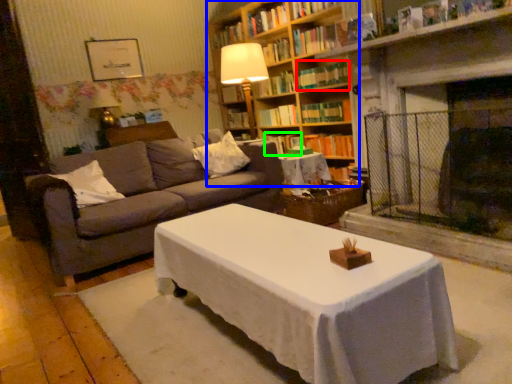
Question: Which object is the closest to the book (highlighted by a red box)? Choose among these: bookcase (highlighted by a blue box) or book (highlighted by a green box).

Choices:
 (A) bookcase
 (B) book

Answer: (A)